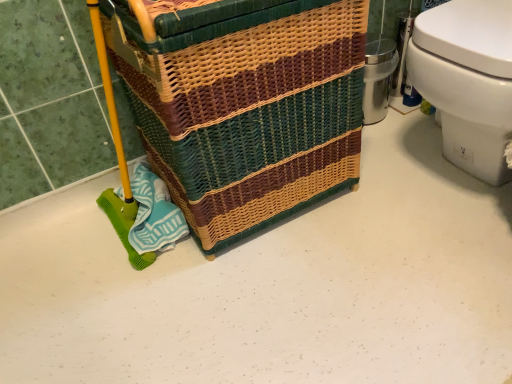
This screenshot has height=384, width=512. Find the location of `free spot in front of woven wicker basket at center`. free spot in front of woven wicker basket at center is located at coordinates (274, 302).